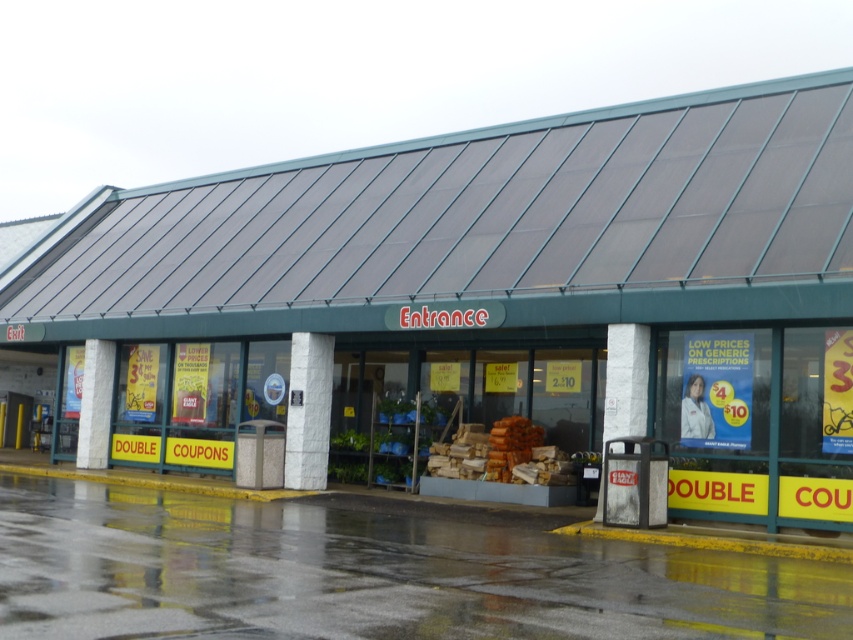
You are standing at the entrance of the retail store and want to take a photo of both the yellow signs with red text inside and the blue circular sign outside. Which point, point (x=610, y=362) or point (x=97, y=413), should you focus on to ensure both signs are in clear view?

You should focus on point (x=610, y=362) because it is closer to the camera than point (x=97, y=413), ensuring better visibility of both signs.

You are standing at the entrance of the retail store and want to locate the white textured pillar at center. According to the coordinates provided, where exactly is it positioned?

The white textured pillar at center is positioned at coordinates point (x=625, y=380).